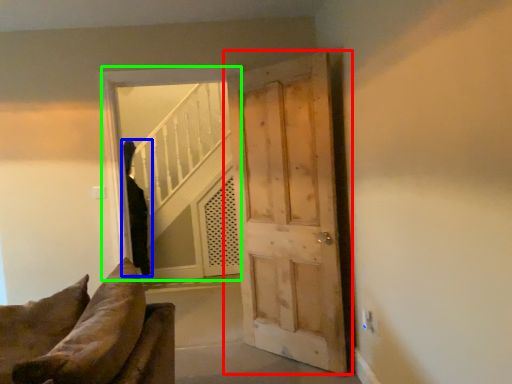
Question: Estimate the real-world distances between objects in this image. Which object is farther from door (highlighted by a red box), person (highlighted by a blue box) or window (highlighted by a green box)?

Choices:
 (A) person
 (B) window

Answer: (A)